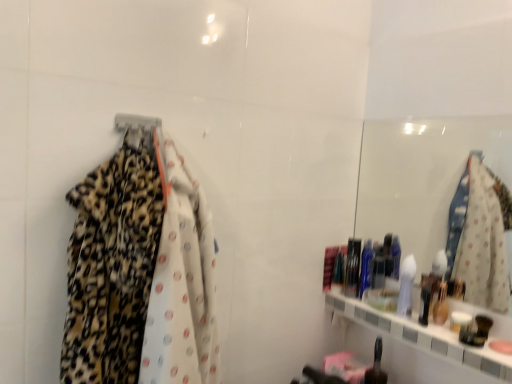
Question: Is point (352, 294) closer or farther from the camera than point (117, 125)?

Choices:
 (A) farther
 (B) closer

Answer: (A)

Question: From the image's perspective, is shiny plastic container at right, marked as the second toiletry in a bottom-to-top arrangement, located above or below metallic silver hanger at upper left?

Choices:
 (A) above
 (B) below

Answer: (B)

Question: Which is nearer to the shiny plastic container at right, which is the 1th toiletry from top to bottom?

Choices:
 (A) leopard print fabric at left
 (B) metallic silver hanger at upper left
 (C) shiny black bottle at lower center, the 2th toiletry in the top-to-bottom sequence

Answer: (C)

Question: Which object is positioned closest to the shiny plastic container at right, which is the 1th toiletry from top to bottom?

Choices:
 (A) shiny black bottle at lower center, acting as the 1th toiletry starting from the front
 (B) metallic silver hanger at upper left
 (C) leopard print fabric at left

Answer: (A)